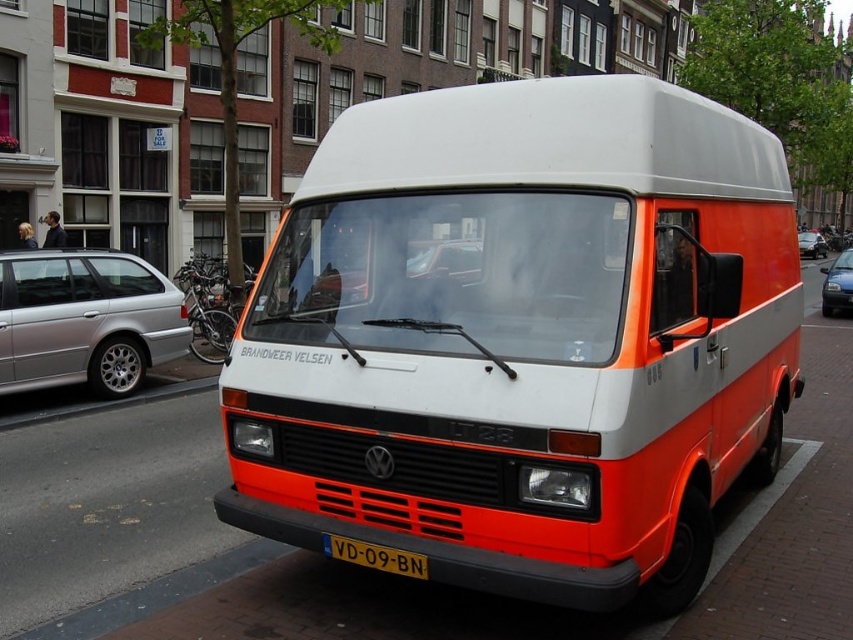
You are a pedestrian standing on the sidewalk next to the road. You see the orange matte van at center and the metallic blue sedan at center. Which vehicle is closer to the curb?

The orange matte van at center is closer to the curb because it is parked to the left of the metallic blue sedan at center, which would place it nearer to the edge of the sidewalk.

You are a delivery driver who needs to park your vehicle in the space between the yellow plastic license plate at center and the metallic silver car at center. Is there enough space for your vehicle which is 4 meters long?

The yellow plastic license plate at center is below metallic silver car at center, so the vertical distance between them is not sufficient for a vehicle of 4 meters in length. You should look for another parking spot.